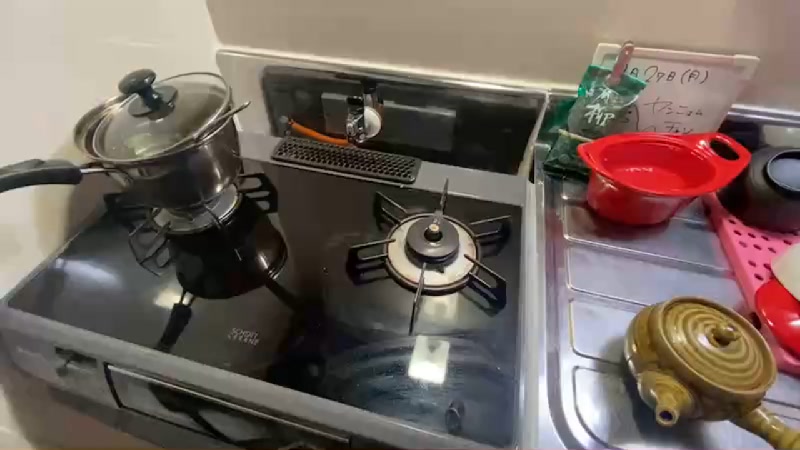
This screenshot has height=450, width=800. What are the coordinates of `stainless steel countertop` in the screenshot? It's located at (604, 283).